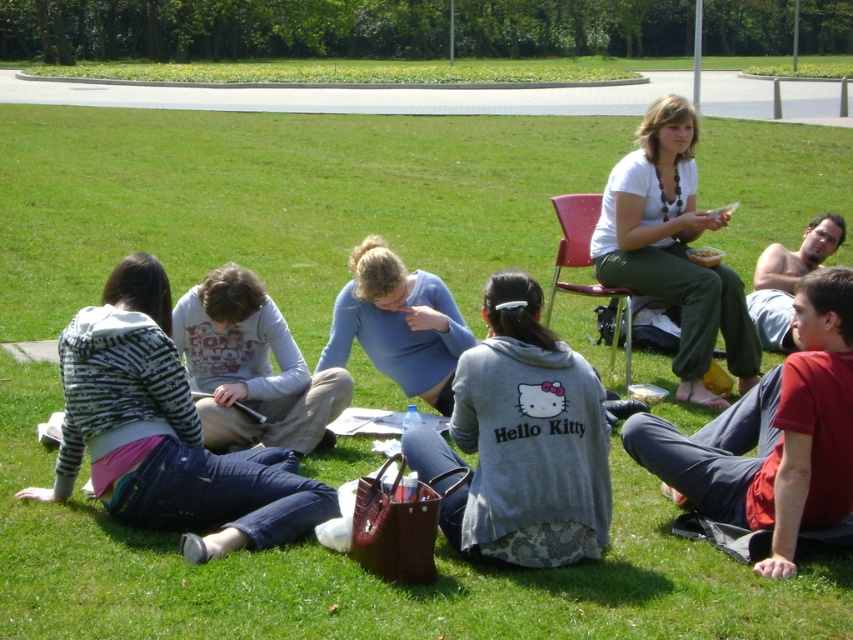
Question: Where is striped sweater at lower left located in relation to blue cotton shirt at center in the image?

Choices:
 (A) left
 (B) right

Answer: (A)

Question: Which object is positioned farthest from the gray fleece jacket at center?

Choices:
 (A) striped sweater at lower left
 (B) red cotton shirt at lower right
 (C) shirtless skin at upper right
 (D) white matte shirt at upper right

Answer: (C)

Question: Which point is farther from the camera taking this photo?

Choices:
 (A) (456, 401)
 (B) (779, 486)
 (C) (811, 253)
 (D) (322, 364)

Answer: (C)

Question: Does gray fleece jacket at center have a larger size compared to plastic pink chair at upper right?

Choices:
 (A) yes
 (B) no

Answer: (B)

Question: Which object is the closest to the red cotton shirt at lower right?

Choices:
 (A) white cotton shirt at center
 (B) plastic pink chair at upper right
 (C) blue cotton shirt at center
 (D) white matte shirt at upper right

Answer: (C)

Question: Is blue cotton shirt at center to the right of plastic pink chair at upper right from the viewer's perspective?

Choices:
 (A) yes
 (B) no

Answer: (B)